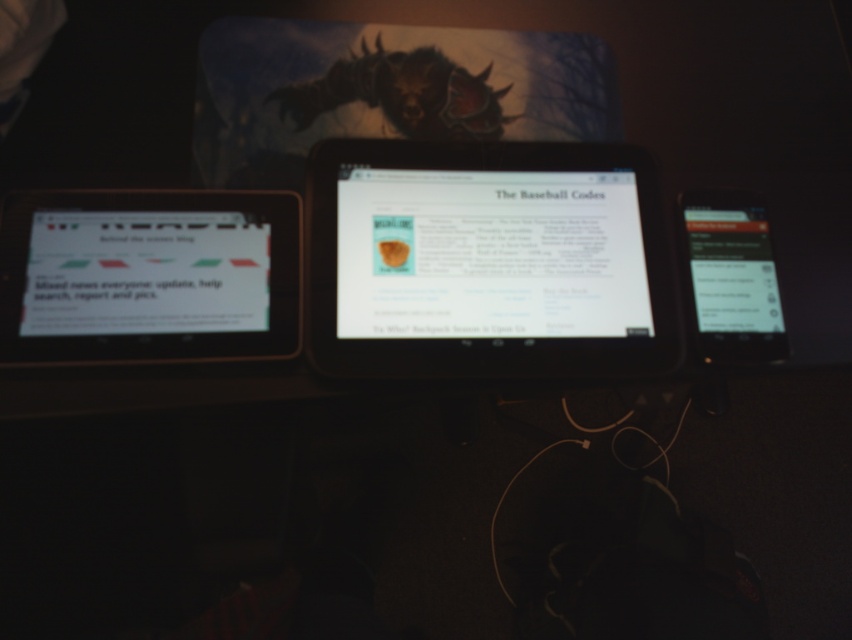
Question: Which object appears closest to the camera in this image?

Choices:
 (A) white glossy tablet at center
 (B) black glossy tablet at right

Answer: (A)

Question: Can you confirm if white glossy tablet at left is positioned to the right of black glossy tablet at right?

Choices:
 (A) no
 (B) yes

Answer: (A)

Question: Which point is closer to the camera?

Choices:
 (A) white glossy tablet at center
 (B) black glossy tablet at right

Answer: (A)

Question: Observing the image, what is the correct spatial positioning of white glossy tablet at left in reference to black glossy tablet at right?

Choices:
 (A) left
 (B) right

Answer: (A)

Question: Can you confirm if white glossy tablet at left is wider than black glossy tablet at right?

Choices:
 (A) no
 (B) yes

Answer: (B)

Question: Which object is the closest to the white glossy tablet at center?

Choices:
 (A) black glossy tablet at right
 (B) white glossy tablet at left

Answer: (A)